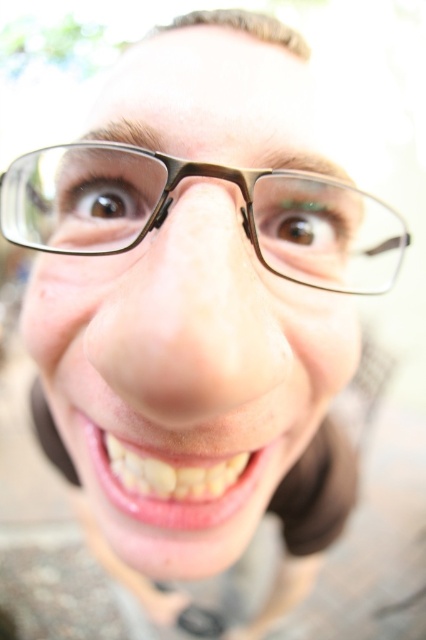
Is matte brown glasses at center smaller than transparent plastic glasses at center?

No, matte brown glasses at center is not smaller than transparent plastic glasses at center.

Is matte brown glasses at center taller than transparent plastic glasses at center?

Yes.

This screenshot has height=640, width=426. Describe the element at coordinates (184, 376) in the screenshot. I see `matte brown glasses at center` at that location.

Find the location of `matte brown glasses at center`. matte brown glasses at center is located at coordinates 184,376.

Based on the photo, can you confirm if transparent plastic glasses at center is positioned to the left of glossy pink lips at center?

In fact, transparent plastic glasses at center is to the right of glossy pink lips at center.

Which is more to the right, transparent plastic glasses at center or glossy pink lips at center?

Positioned to the right is transparent plastic glasses at center.

Find the location of `transparent plastic glasses at center`. transparent plastic glasses at center is located at coordinates (170, 204).

Can you confirm if matte brown glasses at center is thinner than glossy pink lips at center?

In fact, matte brown glasses at center might be wider than glossy pink lips at center.

Is matte brown glasses at center below glossy pink lips at center?

No.

I want to click on matte brown glasses at center, so click(x=184, y=376).